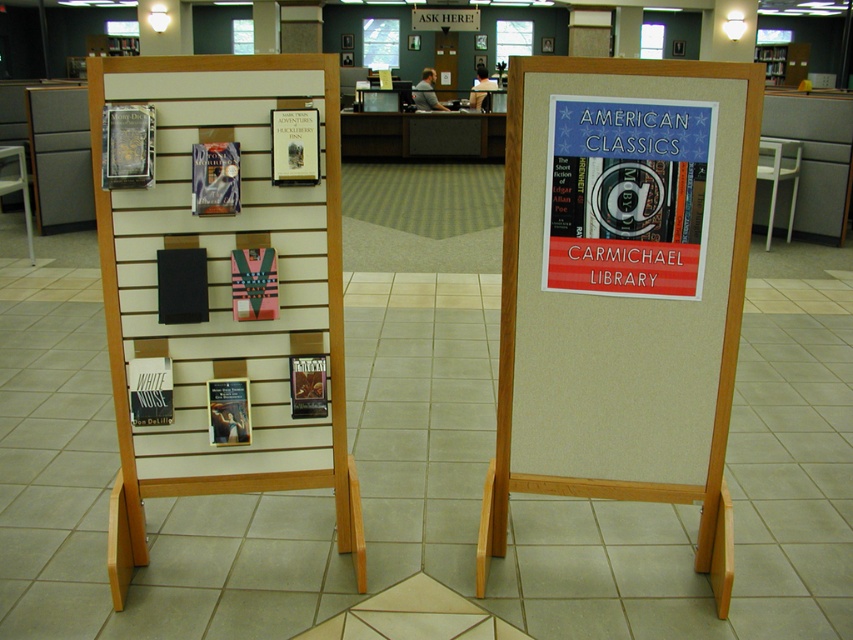
Between point (695, 282) and point (231, 202), which one is positioned behind?

Positioned behind is point (695, 282).

Can you confirm if matte paper sign at center is bigger than metallic silver book at center?

Yes, matte paper sign at center is bigger than metallic silver book at center.

Where is `matte paper sign at center`? This screenshot has width=853, height=640. matte paper sign at center is located at coordinates (627, 195).

Which is in front, point (138, 372) or point (790, 157)?

Point (138, 372)

Is point (164, 392) farther from viewer compared to point (790, 227)?

No, (164, 392) is in front of (790, 227).

Measure the distance between point (151, 388) and camera.

Point (151, 388) is 7.63 feet away from camera.

Locate an element on the screen. white matte book at center is located at coordinates (149, 390).

This screenshot has height=640, width=853. What do you see at coordinates (294, 147) in the screenshot?
I see `hardcover book at upper center` at bounding box center [294, 147].

Between point (314, 122) and point (229, 392), which one is positioned behind?

The point (229, 392) is behind.

Where is `hardcover book at upper center`? The width and height of the screenshot is (853, 640). hardcover book at upper center is located at coordinates (294, 147).